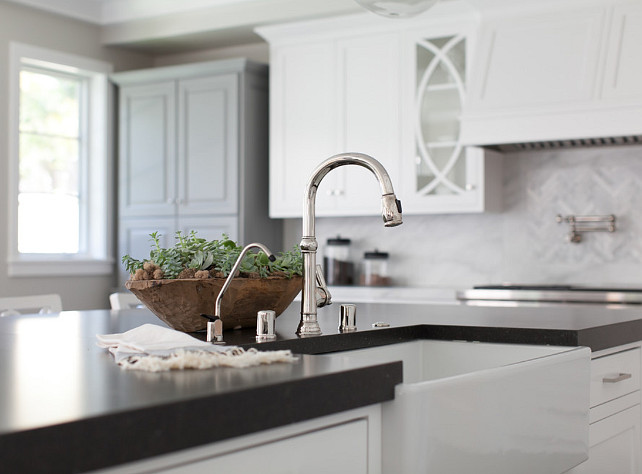
The width and height of the screenshot is (642, 474). What are the coordinates of `wall` in the screenshot? It's located at (506, 241).